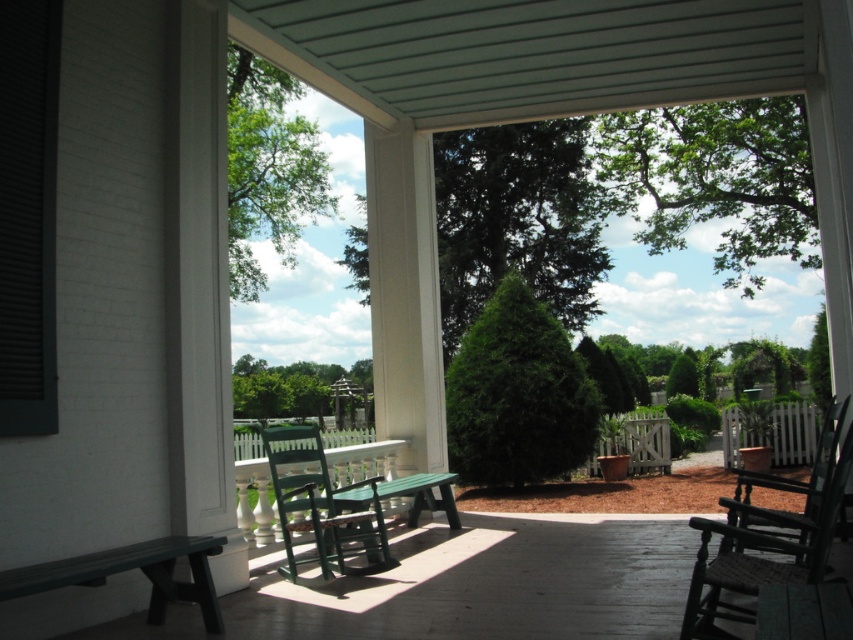
You are planning to place a large potted plant between the rustic woven wood rocking chair at right and the green wood rocking chair at center. Which chair should the plant be closer to if you want it to be equidistant from both chairs?

The plant should be closer to the rustic woven wood rocking chair at right because it is bigger than the green wood rocking chair at center, so the distance between them requires the plant to be positioned nearer to the larger chair to maintain equal distance.

Looking at this image, you are sitting on the green wood rocking chair at center and want to place a book on the green painted wood bench at center. Can you reach the bench without getting up?

The green painted wood bench at center is located below the green wood rocking chair at center, so you can easily reach it while sitting.

You are sitting on the porch and want to move from the green painted wood bench at center to the rustic woven wood rocking chair at right. Which direction should you move to reach it?

To reach the rustic woven wood rocking chair at right from the green painted wood bench at center, you should move upward because the green painted wood bench at center is located below the rustic woven wood rocking chair at right.